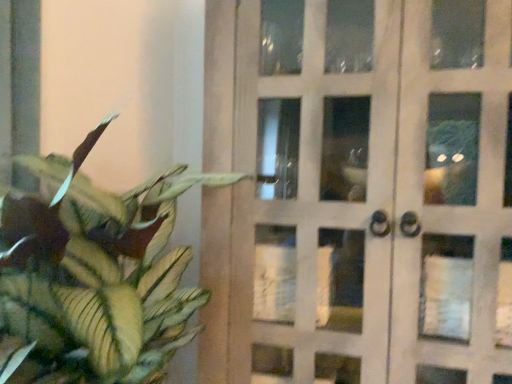
Measure the distance between white glass door at center and camera.

white glass door at center and camera are 33.87 inches apart from each other.

What do you see at coordinates (358, 191) in the screenshot? I see `white glass door at center` at bounding box center [358, 191].

Locate an element on the screen. white glass door at center is located at coordinates (358, 191).

What is the approximate width of white glass door at center?

19.62 inches.

Describe the element at coordinates (93, 276) in the screenshot. I see `green matte leafy plant at left` at that location.

Find the location of a particular element. green matte leafy plant at left is located at coordinates (93, 276).

Where is `white glass door at center`? This screenshot has width=512, height=384. white glass door at center is located at coordinates pyautogui.click(x=358, y=191).

Visually, is white glass door at center positioned to the left or to the right of green matte leafy plant at left?

white glass door at center is to the right of green matte leafy plant at left.

Does white glass door at center come in front of green matte leafy plant at left?

No, it is not.

Does point (221, 275) lie behind point (80, 365)?

Yes, point (221, 275) is behind point (80, 365).

From the image's perspective, which object appears higher, white glass door at center or green matte leafy plant at left?

white glass door at center.

From a real-world perspective, which is physically below, white glass door at center or green matte leafy plant at left?

green matte leafy plant at left is physically lower.

Which object is wider, white glass door at center or green matte leafy plant at left?

green matte leafy plant at left is wider.

Between white glass door at center and green matte leafy plant at left, which one has more height?

white glass door at center is taller.

Between white glass door at center and green matte leafy plant at left, which one has larger size?

white glass door at center is bigger.

Is white glass door at center located outside green matte leafy plant at left?

Absolutely, white glass door at center is external to green matte leafy plant at left.

Is white glass door at center far away from green matte leafy plant at left?

They are positioned close to each other.

Is white glass door at center turned away from green matte leafy plant at left?

That's not correct — white glass door at center is not looking away from green matte leafy plant at left.

How different are the orientations of white glass door at center and green matte leafy plant at left in degrees?

white glass door at center and green matte leafy plant at left are facing 37 degrees away from each other.

This screenshot has height=384, width=512. In order to click on door positioned vertically above the green matte leafy plant at left (from a real-world perspective) in this screenshot , I will do `click(358, 191)`.

Considering the positions of objects green matte leafy plant at left and white glass door at center in the image provided, who is more to the left, green matte leafy plant at left or white glass door at center?

green matte leafy plant at left is more to the left.

Is the depth of green matte leafy plant at left less than that of white glass door at center?

Yes, it is.

Is point (73, 157) closer or farther from the camera than point (290, 340)?

Point (73, 157) appears to be farther away from the viewer than point (290, 340).

From the image's perspective, is green matte leafy plant at left located above or below white glass door at center?

Clearly, from the image's perspective, green matte leafy plant at left is below white glass door at center.

From a real-world perspective, is green matte leafy plant at left located higher than white glass door at center?

Actually, green matte leafy plant at left is physically below white glass door at center in the real world.

Is green matte leafy plant at left thinner than white glass door at center?

In fact, green matte leafy plant at left might be wider than white glass door at center.

Considering the sizes of objects green matte leafy plant at left and white glass door at center in the image provided, who is taller, green matte leafy plant at left or white glass door at center?

With more height is white glass door at center.

Between green matte leafy plant at left and white glass door at center, which one has larger size?

With larger size is white glass door at center.

Is white glass door at center a part of green matte leafy plant at left?

No, white glass door at center is located outside of green matte leafy plant at left.

Is green matte leafy plant at left in contact with white glass door at center?

No, green matte leafy plant at left is not making contact with white glass door at center.

Is green matte leafy plant at left oriented towards white glass door at center?

No, green matte leafy plant at left is not aimed at white glass door at center.

Measure the distance between green matte leafy plant at left and white glass door at center.

green matte leafy plant at left is 12.99 inches from white glass door at center.

Find the location of a particular element. houseplant on the left side of white glass door at center is located at coordinates (93, 276).

The height and width of the screenshot is (384, 512). In order to click on houseplant below the white glass door at center (from the image's perspective) in this screenshot , I will do `click(93, 276)`.

The height and width of the screenshot is (384, 512). Find the location of `houseplant that is on the left side of white glass door at center`. houseplant that is on the left side of white glass door at center is located at coordinates (93, 276).